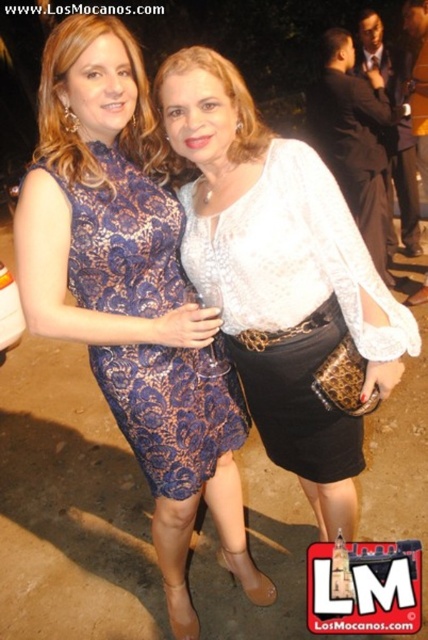
Can you confirm if white lace blouse at center is wider than blue lace dress at center?

Correct, the width of white lace blouse at center exceeds that of blue lace dress at center.

Locate an element on the screen. This screenshot has height=640, width=428. white lace blouse at center is located at coordinates (279, 275).

Is point (279, 385) positioned in front of point (118, 305)?

No, (279, 385) is further to viewer.

Where is `white lace blouse at center`? white lace blouse at center is located at coordinates (279, 275).